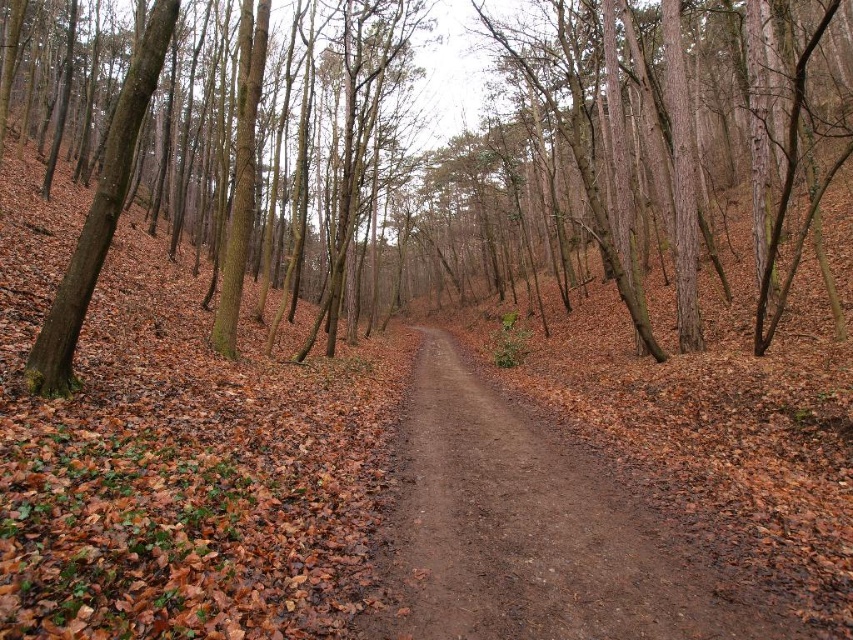
You are a hiker who wants to know if the brown dirt trail at center is higher or lower than the brown rough tree at left. Based on the scene, can you tell me which one is taller?

The brown dirt trail at center has a lesser height compared to brown rough tree at left, so the brown rough tree at left is taller.

You are a hiker who wants to measure the distance between two trees in the forest. You see a brown bark tree at center. How far apart are they?

The brown bark tree at center are 6.38 meters apart.